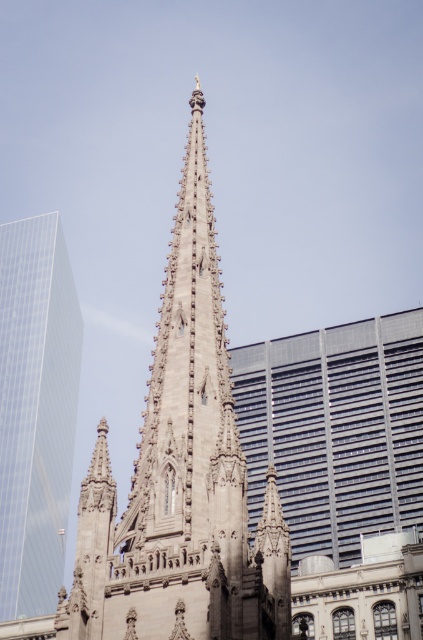
Question: Observing the image, what is the correct spatial positioning of brown stone tower at center in reference to transparent glass skyscraper at left?

Choices:
 (A) below
 (B) above

Answer: (B)

Question: Can you confirm if brown stone tower at center is positioned to the right of transparent glass skyscraper at left?

Choices:
 (A) yes
 (B) no

Answer: (A)

Question: Can you confirm if brown stone tower at center is positioned below transparent glass skyscraper at left?

Choices:
 (A) no
 (B) yes

Answer: (A)

Question: Which point is farther from the camera taking this photo?

Choices:
 (A) (8, 556)
 (B) (123, 605)

Answer: (A)